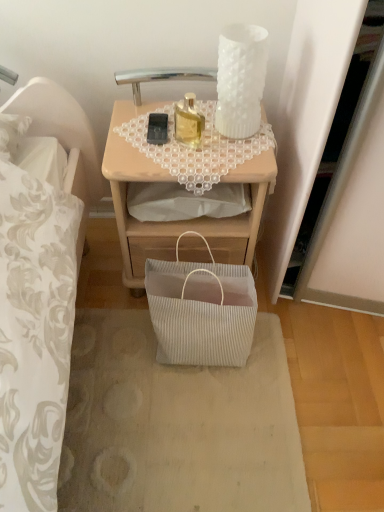
The height and width of the screenshot is (512, 384). In order to click on blank space to the left of translucent glass bottle at center in this screenshot , I will do `click(137, 139)`.